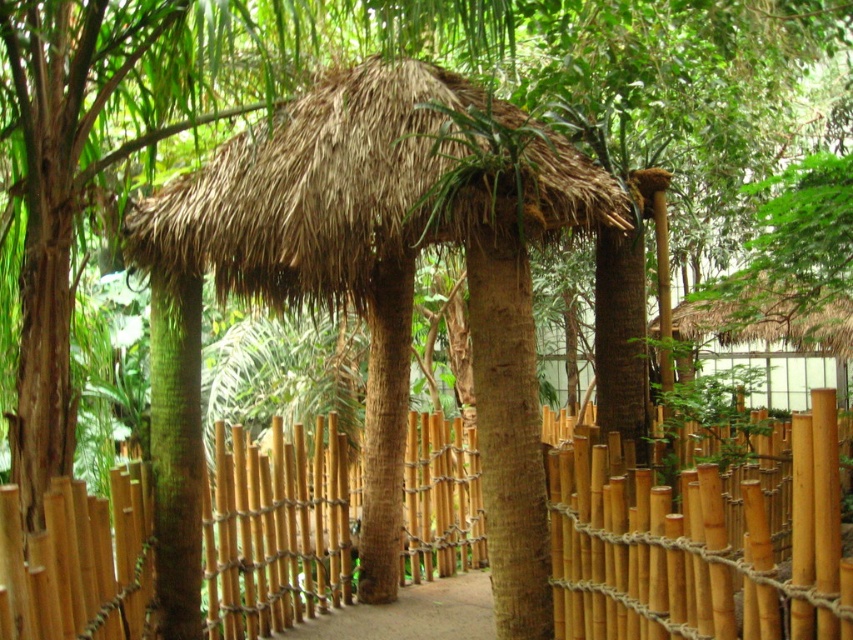
Between point (416, 474) and point (343, 614), which one is positioned in front?

Point (343, 614)

Between bamboo fence at center and brown dirt path at center, which one has more height?

bamboo fence at center is taller.

Locate an element on the screen. The width and height of the screenshot is (853, 640). bamboo fence at center is located at coordinates (700, 540).

Find the location of a particular element. This screenshot has width=853, height=640. bamboo fence at center is located at coordinates (700, 540).

Does bamboo fence at center appear on the right side of thatched straw hut at upper right?

In fact, bamboo fence at center is to the left of thatched straw hut at upper right.

Is point (756, 636) behind point (782, 324)?

No, (756, 636) is closer to viewer.

Where is `bamboo fence at center`? The image size is (853, 640). bamboo fence at center is located at coordinates (700, 540).

In the scene shown: Does thatched straw hut at upper right have a larger size compared to brown dirt path at center?

Yes, thatched straw hut at upper right is bigger than brown dirt path at center.

The width and height of the screenshot is (853, 640). What do you see at coordinates (773, 333) in the screenshot?
I see `thatched straw hut at upper right` at bounding box center [773, 333].

You are a GUI agent. You are given a task and a screenshot of the screen. Output one action in this format:
    pyautogui.click(x=<x>, y=<y>)
    Task: Click on the thatched straw hut at upper right
    Image resolution: width=853 pixels, height=640 pixels.
    Given the screenshot: What is the action you would take?
    pyautogui.click(x=773, y=333)